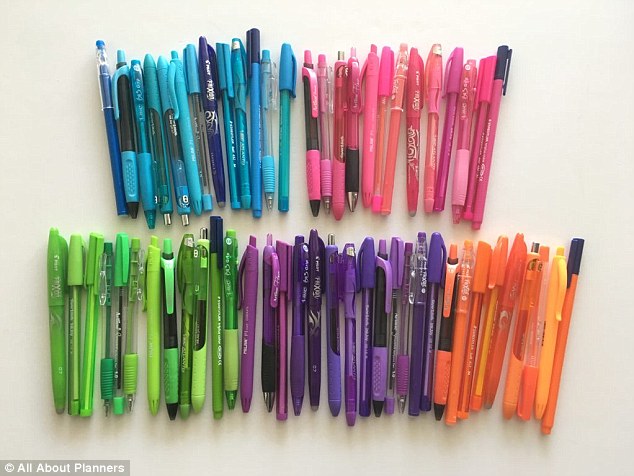
Find the location of a particular element. The image size is (634, 476). orange pen is located at coordinates (443, 333), (456, 334), (469, 337), (486, 330), (495, 350), (515, 327), (532, 348), (546, 337), (557, 350).